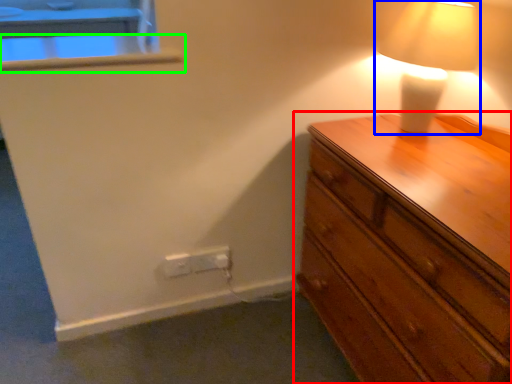
Question: Considering the real-world distances, which object is closest to chest of drawers (highlighted by a red box)? lamp (highlighted by a blue box) or window sill (highlighted by a green box).

Choices:
 (A) lamp
 (B) window sill

Answer: (A)